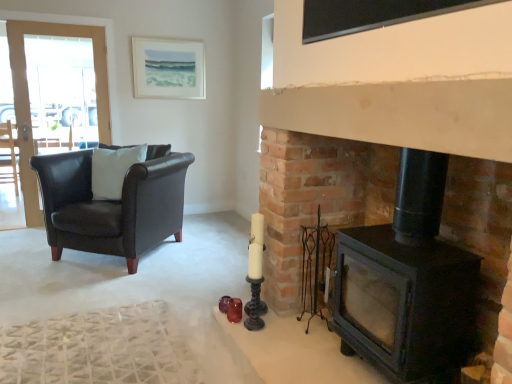
Question: Is the depth of white matte pillow at left less than that of matte white picture frame at upper center?

Choices:
 (A) no
 (B) yes

Answer: (B)

Question: Is white matte pillow at left taller than matte white picture frame at upper center?

Choices:
 (A) yes
 (B) no

Answer: (B)

Question: Considering the relative positions of white matte pillow at left and matte white picture frame at upper center in the image provided, is white matte pillow at left behind matte white picture frame at upper center?

Choices:
 (A) yes
 (B) no

Answer: (B)

Question: From the image's perspective, is white matte pillow at left below matte white picture frame at upper center?

Choices:
 (A) no
 (B) yes

Answer: (B)

Question: Is white matte pillow at left smaller than matte white picture frame at upper center?

Choices:
 (A) no
 (B) yes

Answer: (A)

Question: From a real-world perspective, relative to black matte fireplace at right, is matte white picture frame at upper center vertically above or below?

Choices:
 (A) below
 (B) above

Answer: (B)

Question: In terms of width, does matte white picture frame at upper center look wider or thinner when compared to black matte fireplace at right?

Choices:
 (A) wide
 (B) thin

Answer: (B)

Question: Visually, is matte white picture frame at upper center positioned to the left or to the right of black matte fireplace at right?

Choices:
 (A) left
 (B) right

Answer: (A)

Question: From their relative heights in the image, would you say matte white picture frame at upper center is taller or shorter than black matte fireplace at right?

Choices:
 (A) tall
 (B) short

Answer: (B)

Question: Is matte white picture frame at upper center inside or outside of black glass window screen at upper center?

Choices:
 (A) outside
 (B) inside

Answer: (A)

Question: Is matte white picture frame at upper center in front of or behind black glass window screen at upper center in the image?

Choices:
 (A) front
 (B) behind

Answer: (B)

Question: Is matte white picture frame at upper center taller or shorter than black glass window screen at upper center?

Choices:
 (A) tall
 (B) short

Answer: (A)

Question: Considering the positions of matte white picture frame at upper center and black glass window screen at upper center in the image, is matte white picture frame at upper center wider or thinner than black glass window screen at upper center?

Choices:
 (A) thin
 (B) wide

Answer: (B)

Question: In terms of height, does dark brown leather armchair at left, acting as the first chair starting from the left, look taller or shorter compared to black glass window screen at upper center?

Choices:
 (A) short
 (B) tall

Answer: (B)

Question: Choose the correct answer: Is dark brown leather armchair at left, acting as the first chair starting from the left, inside black glass window screen at upper center or outside it?

Choices:
 (A) outside
 (B) inside

Answer: (A)